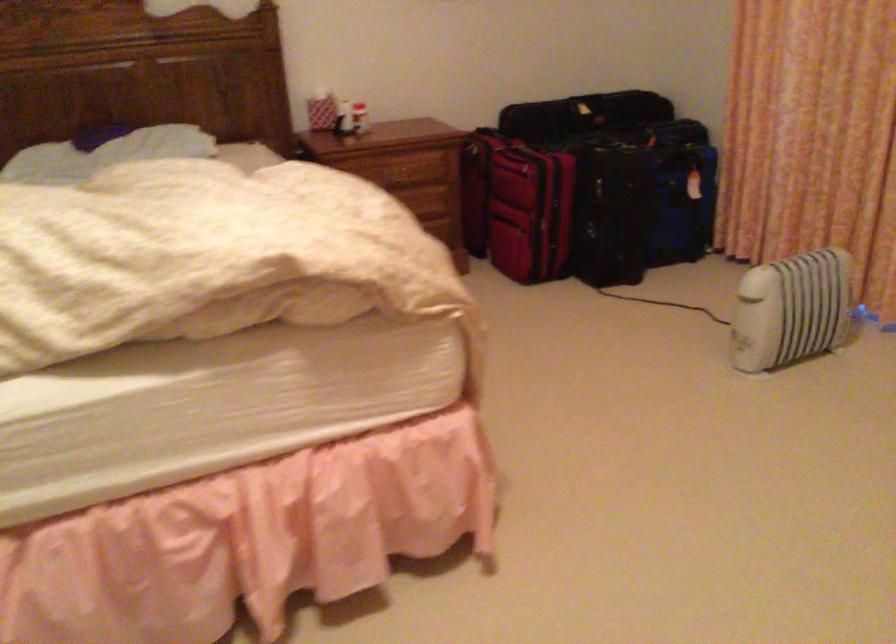
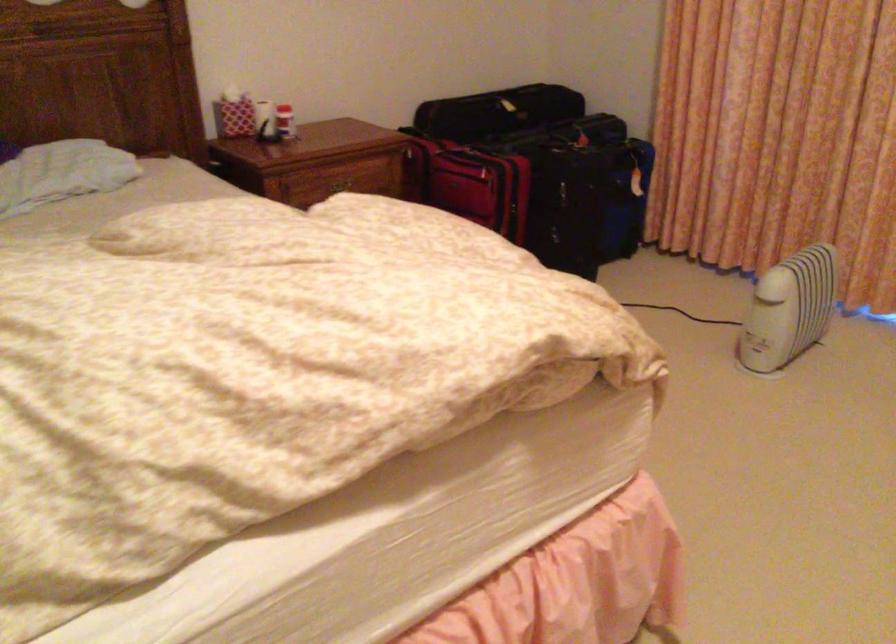
Where in the second image is the point corresponding to [392,167] from the first image?

(338, 185)